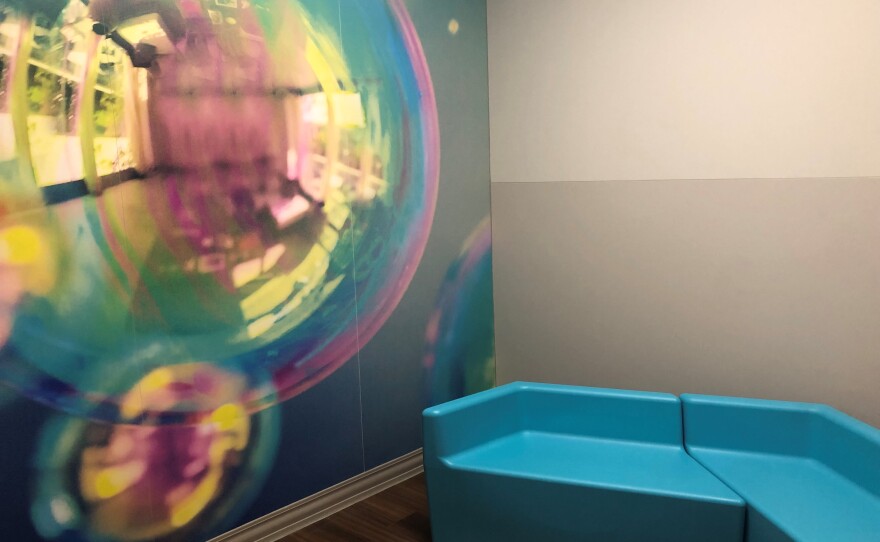
Find the location of a particular element. This screenshot has width=880, height=542. floor is located at coordinates (396, 522).